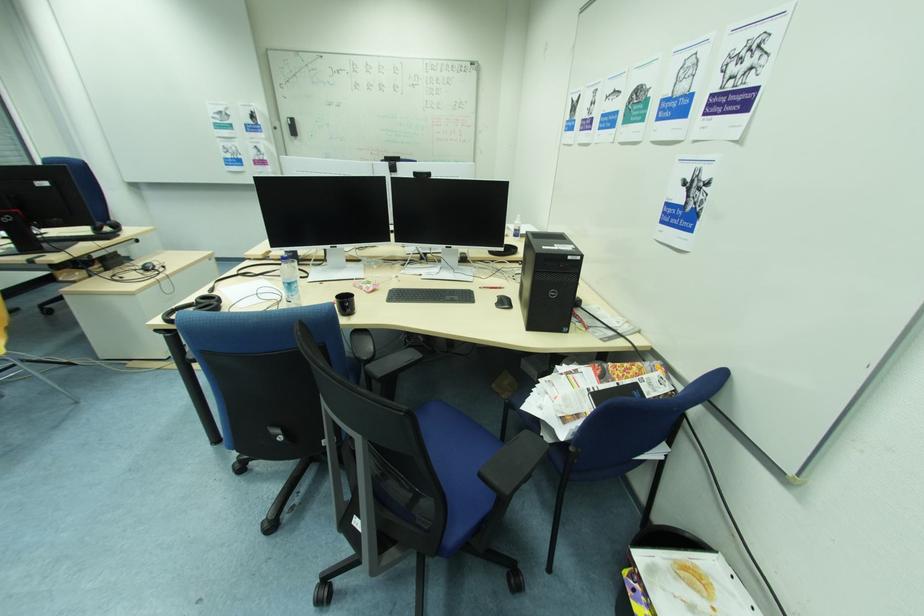
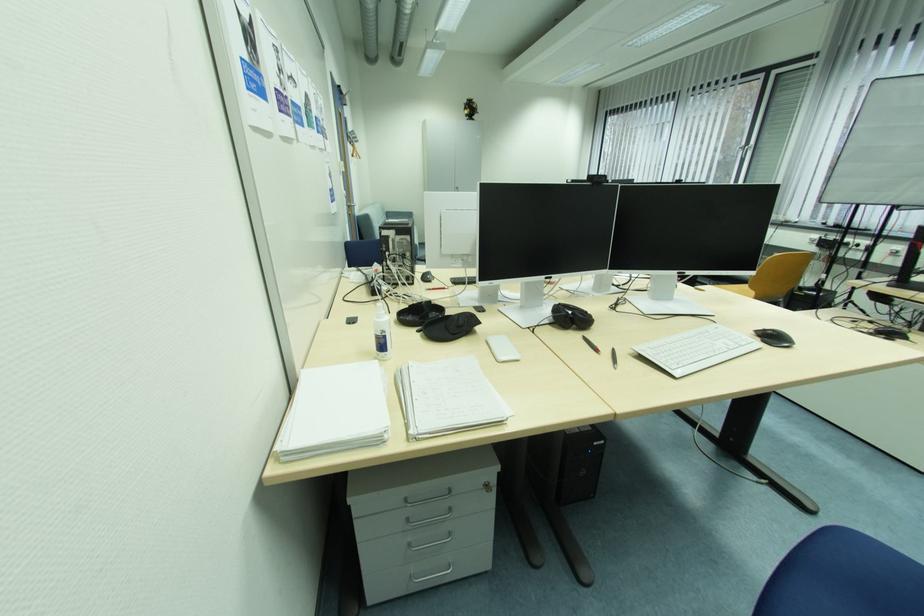
Question: I am providing you with two images of the same scene from different viewpoints. Please identify which objects are invisible in image2.

Choices:
 (A) red binder
 (B) black glasses case
 (C) black chair armrest
 (D) black webcam

Answer: (C)